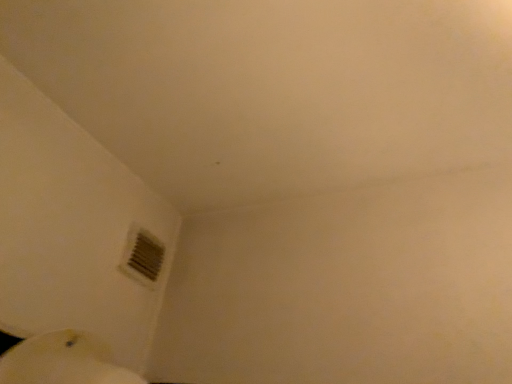
Describe the element at coordinates (142, 257) in the screenshot. This screenshot has width=512, height=384. I see `white plastic air conditioning at lower left` at that location.

What are the coordinates of `white plastic air conditioning at lower left` in the screenshot? It's located at (142, 257).

Locate an element on the screen. The height and width of the screenshot is (384, 512). white plastic air conditioning at lower left is located at coordinates point(142,257).